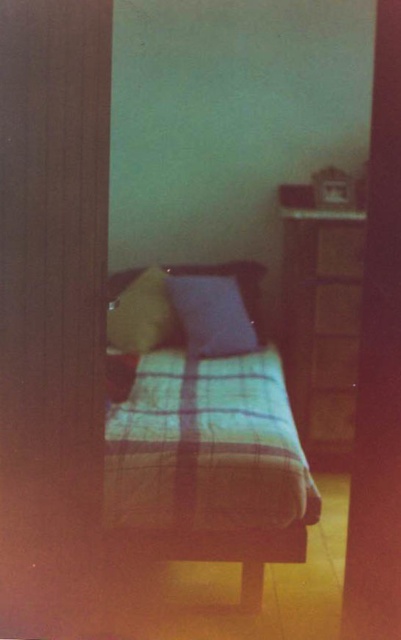
Question: Is plaid fabric bed at center below wooden dresser at right?

Choices:
 (A) yes
 (B) no

Answer: (A)

Question: Which of these objects is positioned closest to the wooden dresser at right?

Choices:
 (A) plaid fabric bed at center
 (B) yellow fabric pillow at center
 (C) matte blue pillow at center

Answer: (C)

Question: Is plaid fabric bed at center positioned in front of matte blue pillow at center?

Choices:
 (A) no
 (B) yes

Answer: (B)

Question: Is plaid fabric bed at center above yellow fabric pillow at center?

Choices:
 (A) no
 (B) yes

Answer: (A)

Question: Which point is closer to the camera?

Choices:
 (A) wooden dresser at right
 (B) yellow fabric pillow at center
 (C) plaid fabric bed at center

Answer: (A)

Question: Which of the following is the closest to the observer?

Choices:
 (A) plaid fabric bed at center
 (B) yellow fabric pillow at center

Answer: (A)